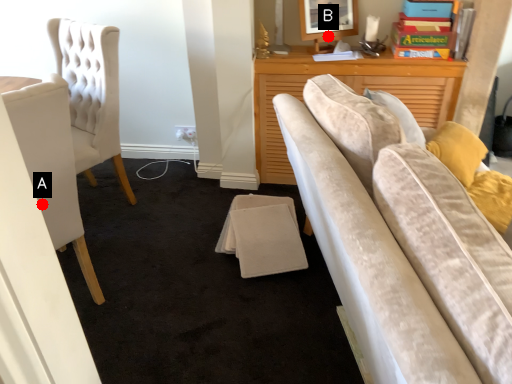
Question: Two points are circled on the image, labeled by A and B beside each circle. Among these points, which one is farthest from the camera?

Choices:
 (A) A is further
 (B) B is further

Answer: (B)